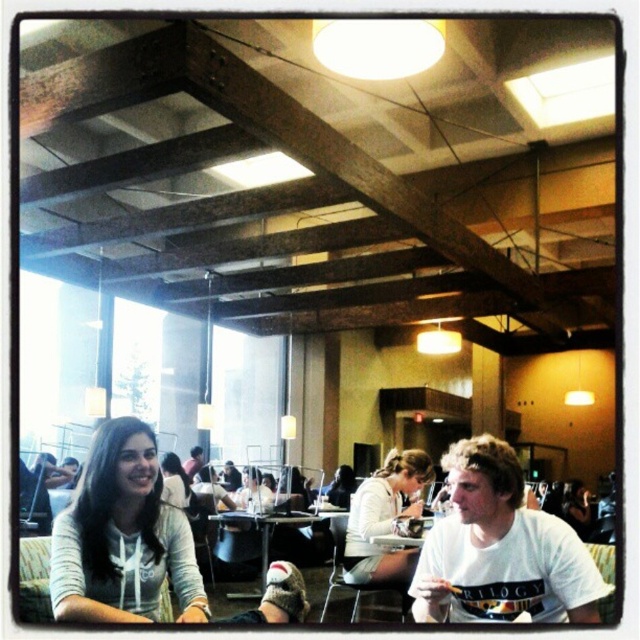
Does light gray hoodie at lower left have a greater width compared to matte black laptop at center?

Indeed, light gray hoodie at lower left has a greater width compared to matte black laptop at center.

Does light gray hoodie at lower left have a larger size compared to matte black laptop at center?

Yes, light gray hoodie at lower left is bigger than matte black laptop at center.

Who is more distant from viewer, [184,602] or [195,468]?

The point [195,468] is behind.

Locate an element on the screen. light gray hoodie at lower left is located at coordinates point(122,536).

Between white matte jacket at center and matte white hoodie at lower left, which one has more height?

white matte jacket at center

Describe the element at coordinates (385, 518) in the screenshot. I see `white matte jacket at center` at that location.

Where is `white matte jacket at center`? This screenshot has width=640, height=640. white matte jacket at center is located at coordinates (385, 518).

Who is more distant from viewer, [376,564] or [336,515]?

Positioned behind is point [336,515].

Who is lower down, white matte jacket at center or wooden table at center?

wooden table at center is lower down.

Measure the distance between white matte jacket at center and camera.

3.79 meters

Find the location of a particular element. This screenshot has width=640, height=640. white matte jacket at center is located at coordinates (385, 518).